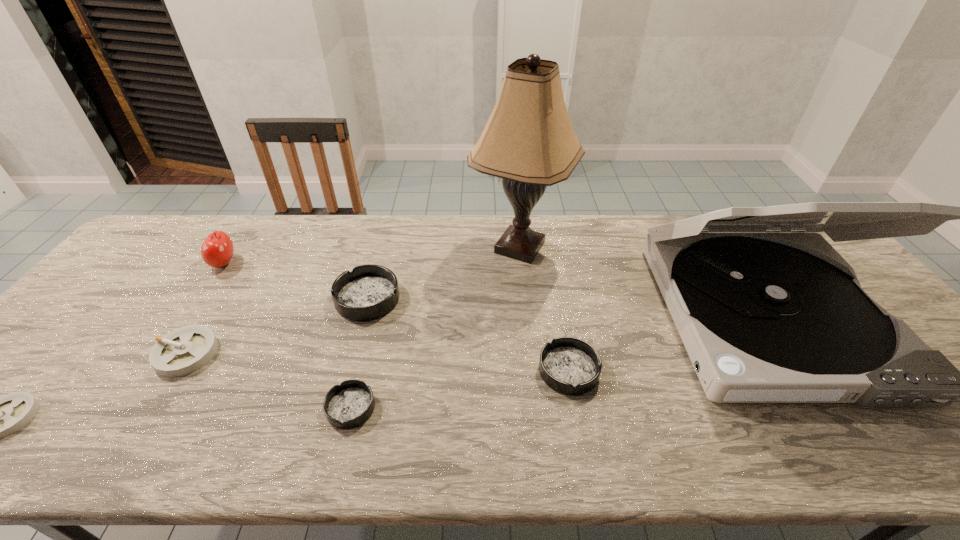
This screenshot has height=540, width=960. I want to click on free location that satisfies the following two spatial constraints: 1. on the back side of the beige lamp; 2. on the right side of the smallest dark ashtray, so click(x=390, y=247).

Locate an element on the screen. vacant region that satisfies the following two spatial constraints: 1. on the front side of the rightmost dark ashtray; 2. on the left side of the sixth shortest object is located at coordinates (153, 370).